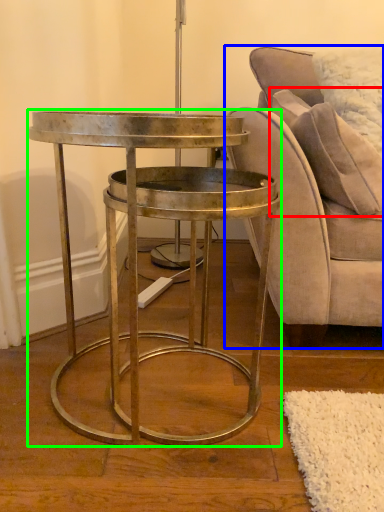
Question: Which object is positioned closest to pillow (highlighted by a red box)? Select from chair (highlighted by a blue box) and table (highlighted by a green box).

Choices:
 (A) chair
 (B) table

Answer: (A)